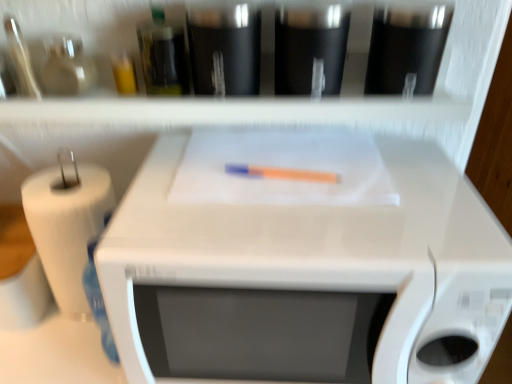
Find the location of a particular element. free location to the right of orange matte crayon at center is located at coordinates (394, 178).